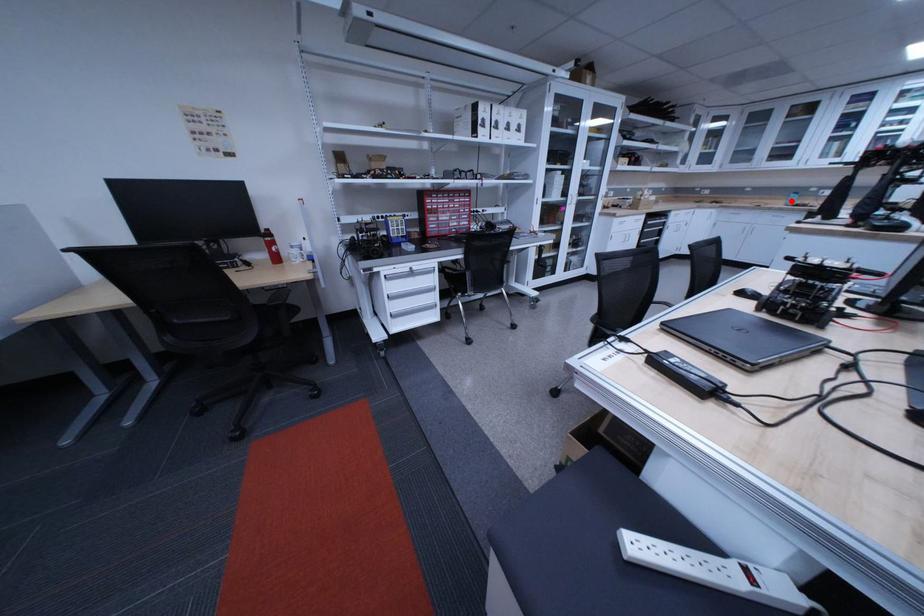
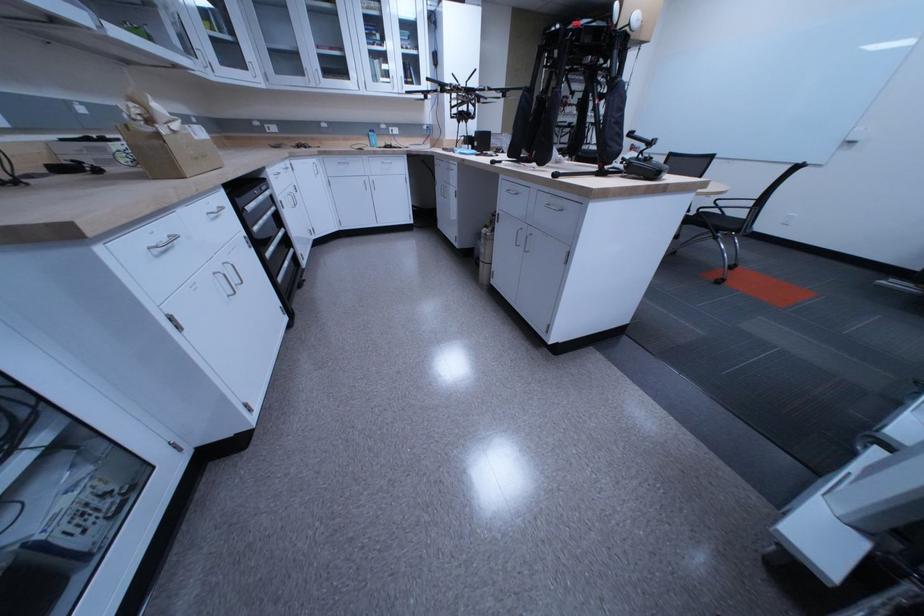
Where in the second image is the point corresponding to the highlighted location from the first image?

(373, 140)